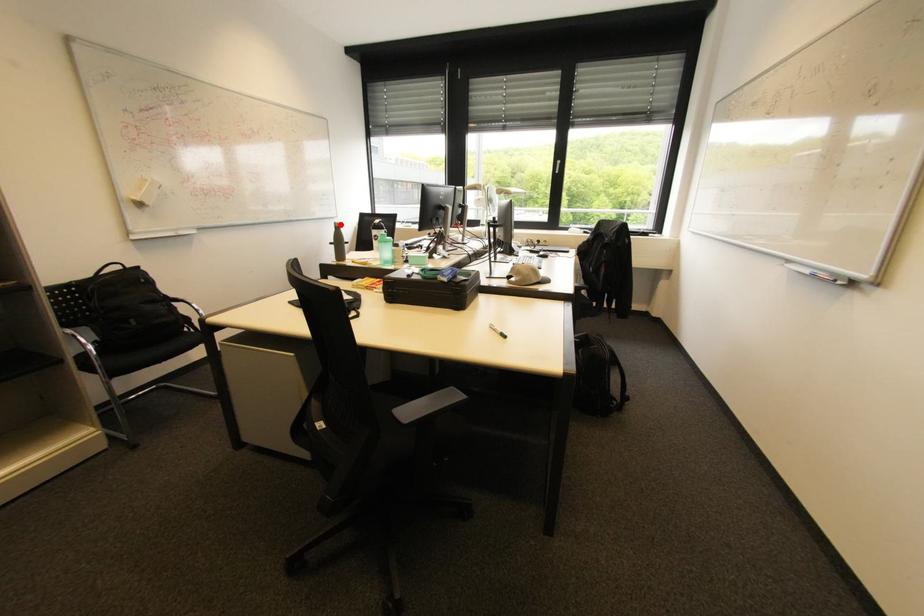
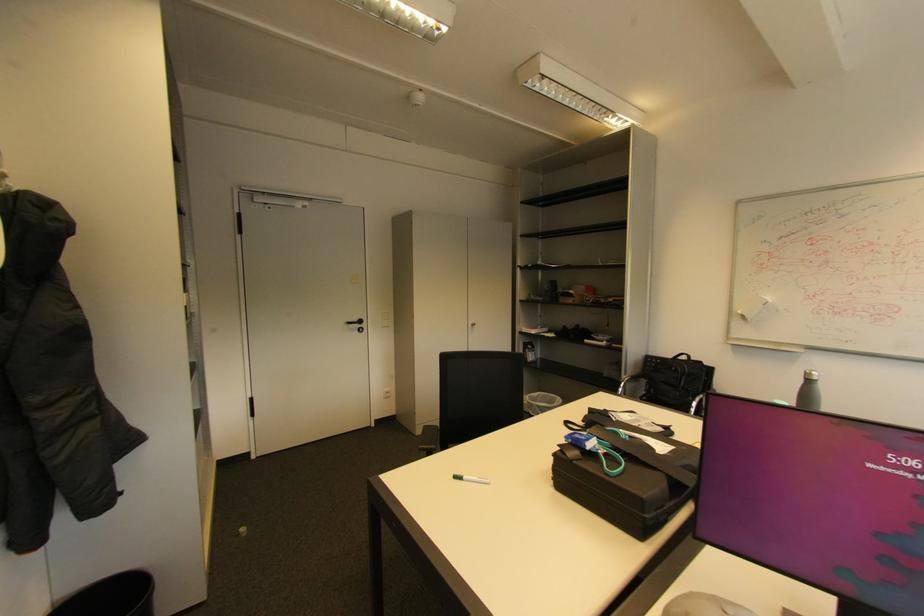
Where in the second image is the point corresponding to the highlighted location from the first image?

(811, 373)